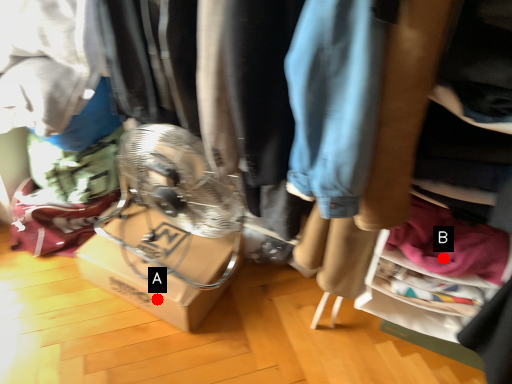
Question: Two points are circled on the image, labeled by A and B beside each circle. Which point appears farthest from the camera in this image?

Choices:
 (A) A is further
 (B) B is further

Answer: (A)